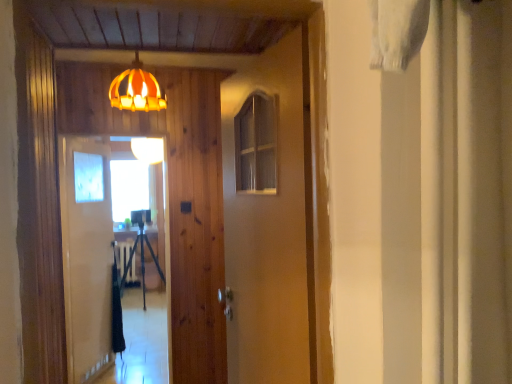
Question: Does wooden barn door at center have a lesser height compared to dark green fabric at center?

Choices:
 (A) yes
 (B) no

Answer: (B)

Question: Does wooden barn door at center have a smaller size compared to dark green fabric at center?

Choices:
 (A) yes
 (B) no

Answer: (A)

Question: From the image's perspective, does wooden barn door at center appear lower than dark green fabric at center?

Choices:
 (A) no
 (B) yes

Answer: (A)

Question: Is wooden barn door at center at the left side of dark green fabric at center?

Choices:
 (A) yes
 (B) no

Answer: (B)

Question: Is wooden barn door at center positioned beyond the bounds of dark green fabric at center?

Choices:
 (A) yes
 (B) no

Answer: (A)

Question: Based on their positions, is clear glass screen door at center, placed as the first screen door when sorted from front to back, located to the left or right of clear glass screen door at center, positioned as the second screen door in front-to-back order?

Choices:
 (A) left
 (B) right

Answer: (B)

Question: In terms of width, does clear glass screen door at center, the second screen door viewed from the back, look wider or thinner when compared to clear glass screen door at center, positioned as the second screen door in front-to-back order?

Choices:
 (A) wide
 (B) thin

Answer: (B)

Question: From the image's perspective, is clear glass screen door at center, placed as the first screen door when sorted from front to back, located above or below clear glass screen door at center, which is the 1th screen door from back to front?

Choices:
 (A) below
 (B) above

Answer: (A)

Question: Is point (141, 367) closer or farther from the camera than point (76, 345)?

Choices:
 (A) farther
 (B) closer

Answer: (A)

Question: Is dark green fabric at center inside the boundaries of clear glass screen door at center, the second screen door viewed from the back, or outside?

Choices:
 (A) inside
 (B) outside

Answer: (B)

Question: From the image's perspective, is dark green fabric at center above or below clear glass screen door at center, the second screen door viewed from the back?

Choices:
 (A) below
 (B) above

Answer: (A)

Question: In terms of size, does dark green fabric at center appear bigger or smaller than clear glass screen door at center, the second screen door viewed from the back?

Choices:
 (A) small
 (B) big

Answer: (B)

Question: In the image, is dark green fabric at center positioned in front of or behind clear glass screen door at center, placed as the first screen door when sorted from front to back?

Choices:
 (A) behind
 (B) front

Answer: (A)

Question: From their relative heights in the image, would you say wooden barn door at center is taller or shorter than matte orange lampshade at upper center, arranged as the 1th lamp when viewed from the back?

Choices:
 (A) short
 (B) tall

Answer: (B)

Question: In the image, is wooden barn door at center positioned in front of or behind matte orange lampshade at upper center, placed as the second lamp when sorted from front to back?

Choices:
 (A) front
 (B) behind

Answer: (A)